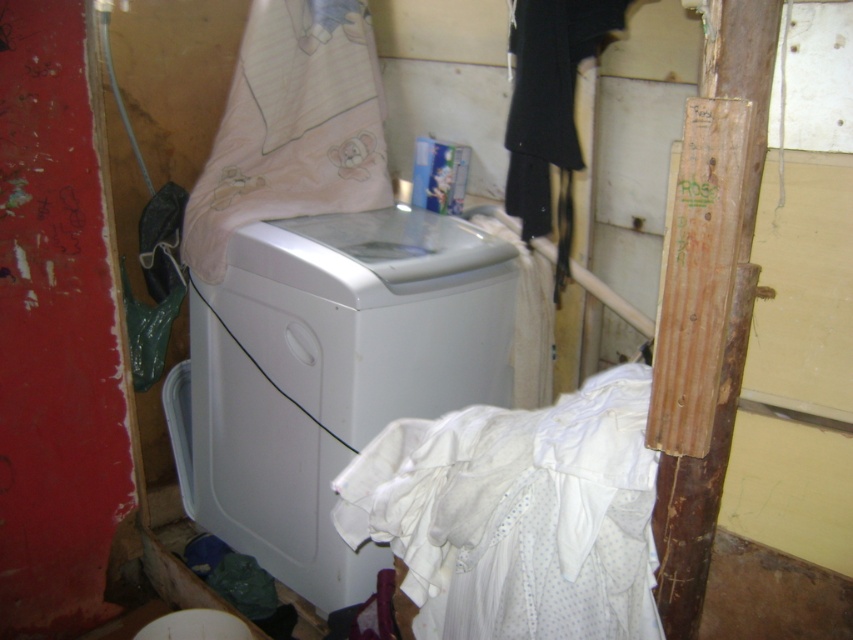
Is white plastic washing machine at center smaller than pink fabric laundry at center?

No.

Does point (173, 442) come closer to viewer compared to point (294, 173)?

That is False.

Does point (358, 564) come farther from viewer compared to point (263, 129)?

No.

The image size is (853, 640). What are the coordinates of `white plastic washing machine at center` in the screenshot? It's located at (331, 372).

Looking at this image, between white cotton laundry at center and pink fabric laundry at center, which one has more height?

pink fabric laundry at center

Describe the element at coordinates (517, 515) in the screenshot. I see `white cotton laundry at center` at that location.

Locate an element on the screen. The width and height of the screenshot is (853, 640). white cotton laundry at center is located at coordinates (517, 515).

Can you confirm if white plastic washing machine at center is positioned to the right of white cotton laundry at center?

In fact, white plastic washing machine at center is to the left of white cotton laundry at center.

Does white plastic washing machine at center have a lesser width compared to white cotton laundry at center?

No.

This screenshot has height=640, width=853. Find the location of `white plastic washing machine at center`. white plastic washing machine at center is located at coordinates (331, 372).

The height and width of the screenshot is (640, 853). What are the coordinates of `white plastic washing machine at center` in the screenshot? It's located at (331, 372).